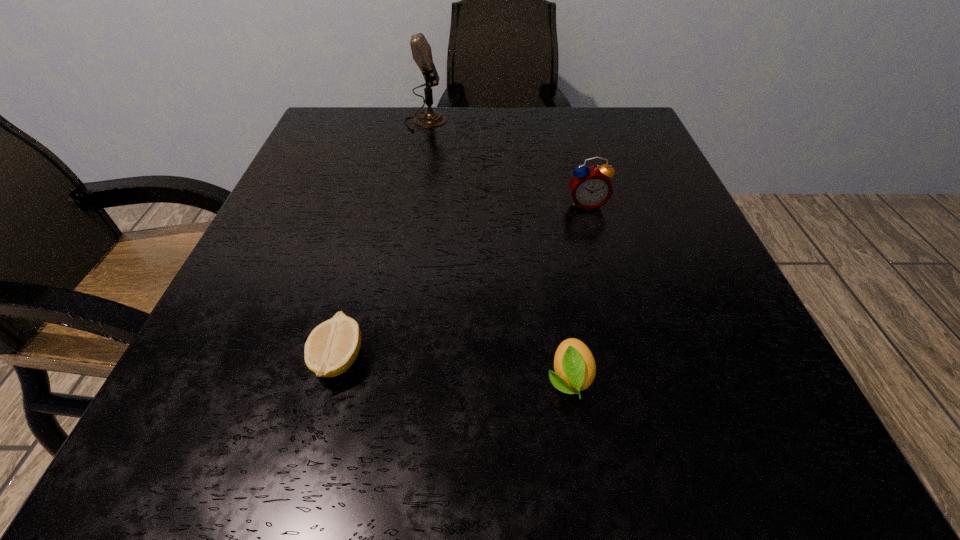
This screenshot has height=540, width=960. In the image, there is a desktop. What are the coordinates of `free space at the near left corner` in the screenshot? It's located at (229, 455).

In the image, there is a desktop. Where is `vacant area at the far right corner`? This screenshot has height=540, width=960. vacant area at the far right corner is located at coordinates (623, 129).

Find the location of a particular element. Image resolution: width=960 pixels, height=540 pixels. vacant area at the near right corner is located at coordinates (720, 456).

I want to click on vacant region between the right lemon and the left lemon, so click(x=453, y=369).

Where is `free space between the third tallest object and the microphone`? This screenshot has width=960, height=540. free space between the third tallest object and the microphone is located at coordinates (497, 250).

Find the location of a particular element. The width and height of the screenshot is (960, 540). empty space between the third tallest object and the farthest object is located at coordinates (497, 250).

The image size is (960, 540). In order to click on empty space between the shorter lemon and the alarm clock in this screenshot , I will do `click(463, 281)`.

Image resolution: width=960 pixels, height=540 pixels. Identify the location of empty space that is in between the shorter lemon and the microphone. (382, 240).

Identify the location of free space between the third shortest object and the shortest object. The image size is (960, 540). (463, 281).

Find the location of `free area in between the shortest object and the taller lemon`. free area in between the shortest object and the taller lemon is located at coordinates (453, 369).